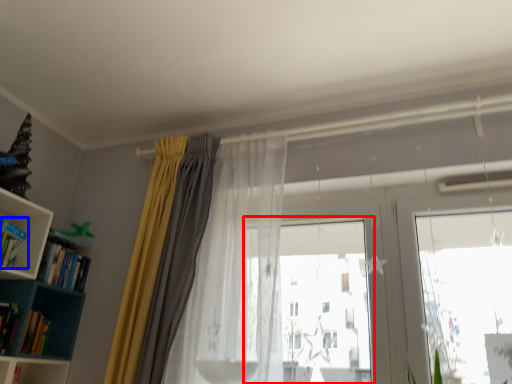
Question: Which of the following is the farthest to the observer, bay window (highlighted by a red box) or book (highlighted by a blue box)?

Choices:
 (A) bay window
 (B) book

Answer: (B)